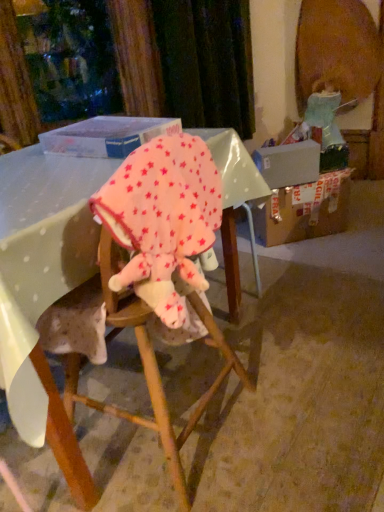
Question: Considering the relative sizes of pink fleece blanket at center and pink fleece baby elephant at center in the image provided, is pink fleece blanket at center thinner than pink fleece baby elephant at center?

Choices:
 (A) no
 (B) yes

Answer: (A)

Question: Considering the relative sizes of pink fleece blanket at center and pink fleece baby elephant at center in the image provided, is pink fleece blanket at center shorter than pink fleece baby elephant at center?

Choices:
 (A) no
 (B) yes

Answer: (A)

Question: Does pink fleece blanket at center appear on the left side of pink fleece baby elephant at center?

Choices:
 (A) no
 (B) yes

Answer: (B)

Question: Does pink fleece blanket at center come in front of pink fleece baby elephant at center?

Choices:
 (A) yes
 (B) no

Answer: (B)

Question: Is pink fleece blanket at center in contact with pink fleece baby elephant at center?

Choices:
 (A) no
 (B) yes

Answer: (A)

Question: Considering their positions, is pink fleece baby elephant at center located in front of or behind pink fleece blanket at center?

Choices:
 (A) behind
 (B) front

Answer: (B)

Question: Considering the positions of point (201, 282) and point (112, 266), is point (201, 282) closer or farther from the camera than point (112, 266)?

Choices:
 (A) farther
 (B) closer

Answer: (A)

Question: Is pink fleece baby elephant at center bigger or smaller than pink fleece blanket at center?

Choices:
 (A) small
 (B) big

Answer: (A)

Question: Considering the positions of pink fleece baby elephant at center and pink fleece blanket at center in the image, is pink fleece baby elephant at center wider or thinner than pink fleece blanket at center?

Choices:
 (A) wide
 (B) thin

Answer: (B)

Question: Based on their positions, is brown cardboard box at right located to the left or right of pink fleece blanket at center?

Choices:
 (A) left
 (B) right

Answer: (B)

Question: Relative to pink fleece blanket at center, is brown cardboard box at right in front or behind?

Choices:
 (A) front
 (B) behind

Answer: (B)

Question: Looking at the image, does brown cardboard box at right seem bigger or smaller compared to pink fleece blanket at center?

Choices:
 (A) small
 (B) big

Answer: (A)

Question: Is brown cardboard box at right taller or shorter than pink fleece blanket at center?

Choices:
 (A) tall
 (B) short

Answer: (B)

Question: Based on their positions, is brown cardboard box at right located to the left or right of pink fleece baby elephant at center?

Choices:
 (A) right
 (B) left

Answer: (A)

Question: Is point coord(271,244) positioned closer to the camera than point coord(165,219)?

Choices:
 (A) closer
 (B) farther

Answer: (B)